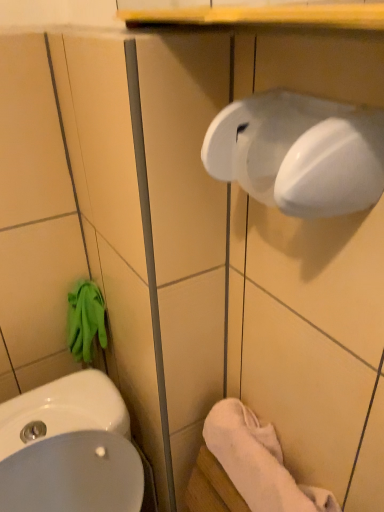
What is the approximate width of white glossy sink at lower left?

It is 45.65 centimeters.

The width and height of the screenshot is (384, 512). What are the coordinates of `white glossy sink at lower left` in the screenshot? It's located at point(69,449).

This screenshot has width=384, height=512. What do you see at coordinates (258, 462) in the screenshot?
I see `white soft towel at lower right` at bounding box center [258, 462].

Find the location of a particular element. white glossy hand dryer at upper right is located at coordinates (299, 153).

Image resolution: width=384 pixels, height=512 pixels. Find the location of `white glossy sink at lower left`. white glossy sink at lower left is located at coordinates (69, 449).

Considering the positions of points (51, 495) and (276, 91), is point (51, 495) closer to camera compared to point (276, 91)?

No, it is behind (276, 91).

Identify the location of sink lying behind the white glossy hand dryer at upper right. click(x=69, y=449).

In terms of width, does white glossy sink at lower left look wider or thinner when compared to white glossy hand dryer at upper right?

In the image, white glossy sink at lower left appears to be wider than white glossy hand dryer at upper right.

Image resolution: width=384 pixels, height=512 pixels. I want to click on sink on the left of white glossy hand dryer at upper right, so [x=69, y=449].

Are white glossy hand dryer at upper right and white glossy sink at lower left far apart?

No, white glossy hand dryer at upper right is not far away from white glossy sink at lower left.

Can you tell me how much white glossy hand dryer at upper right and white glossy sink at lower left differ in facing direction?

90 degrees.

Looking at this image, is white glossy hand dryer at upper right turned away from white glossy sink at lower left?

No, white glossy hand dryer at upper right's orientation is not away from white glossy sink at lower left.

In terms of height, does white soft towel at lower right look taller or shorter compared to white glossy hand dryer at upper right?

In the image, white soft towel at lower right appears to be taller than white glossy hand dryer at upper right.

Considering their positions, is white soft towel at lower right located in front of or behind white glossy hand dryer at upper right?

white soft towel at lower right is positioned farther from the viewer than white glossy hand dryer at upper right.

Considering the sizes of objects white soft towel at lower right and white glossy hand dryer at upper right in the image provided, who is smaller, white soft towel at lower right or white glossy hand dryer at upper right?

white glossy hand dryer at upper right is smaller.

Is white soft towel at lower right far away from white glossy hand dryer at upper right?

No, white soft towel at lower right is not far from white glossy hand dryer at upper right.

Which of these two, white soft towel at lower right or white glossy sink at lower left, is wider?

white glossy sink at lower left.

Is white soft towel at lower right surrounding white glossy sink at lower left?

Definitely not — white glossy sink at lower left is not inside white soft towel at lower right.

Considering the relative positions of white soft towel at lower right and white glossy sink at lower left in the image provided, is white soft towel at lower right to the left or to the right of white glossy sink at lower left?

Clearly, white soft towel at lower right is on the right of white glossy sink at lower left in the image.

How distant is white glossy hand dryer at upper right from white soft towel at lower right?

19.21 inches.

Is white glossy hand dryer at upper right next to white soft towel at lower right?

There is a gap between white glossy hand dryer at upper right and white soft towel at lower right.

Is white glossy hand dryer at upper right wider or thinner than white soft towel at lower right?

Considering their sizes, white glossy hand dryer at upper right looks slimmer than white soft towel at lower right.

Is white glossy hand dryer at upper right facing away from white soft towel at lower right?

No.

Where is `towel/napkin positioned vertically above the white glossy sink at lower left (from a real-world perspective)`? towel/napkin positioned vertically above the white glossy sink at lower left (from a real-world perspective) is located at coordinates (258, 462).

In the scene shown: Between white glossy sink at lower left and white soft towel at lower right, which one appears on the left side from the viewer's perspective?

Positioned to the left is white glossy sink at lower left.

In the scene shown: Does white glossy sink at lower left have a greater height compared to white soft towel at lower right?

Yes, white glossy sink at lower left is taller than white soft towel at lower right.

The width and height of the screenshot is (384, 512). Find the location of `hand dryer above the white glossy sink at lower left (from the image's perspective)`. hand dryer above the white glossy sink at lower left (from the image's perspective) is located at coordinates (299, 153).

Identify the location of hand dryer on the right side of white glossy sink at lower left. (299, 153).

Consider the image. Which object lies nearer to the anchor point white glossy sink at lower left, white soft towel at lower right or white glossy hand dryer at upper right?

white soft towel at lower right is positioned closer to the anchor white glossy sink at lower left.

Considering their positions, is white soft towel at lower right positioned further to white glossy hand dryer at upper right than white glossy sink at lower left?

white glossy sink at lower left is further to white glossy hand dryer at upper right.

Looking at the image, which one is located closer to white soft towel at lower right, white glossy sink at lower left or white glossy hand dryer at upper right?

white glossy sink at lower left lies closer to white soft towel at lower right than the other object.

Estimate the real-world distances between objects in this image. Which object is further from white soft towel at lower right, white glossy hand dryer at upper right or white glossy sink at lower left?

white glossy hand dryer at upper right is further to white soft towel at lower right.

Estimate the real-world distances between objects in this image. Which object is further from white glossy hand dryer at upper right, white glossy sink at lower left or white soft towel at lower right?

white glossy sink at lower left is further to white glossy hand dryer at upper right.

From the image, which object appears to be farther from white glossy sink at lower left, white glossy hand dryer at upper right or white soft towel at lower right?

white glossy hand dryer at upper right is further to white glossy sink at lower left.

This screenshot has width=384, height=512. What are the coordinates of `towel/napkin between white glossy hand dryer at upper right and white glossy sink at lower left in the vertical direction` in the screenshot? It's located at (258, 462).